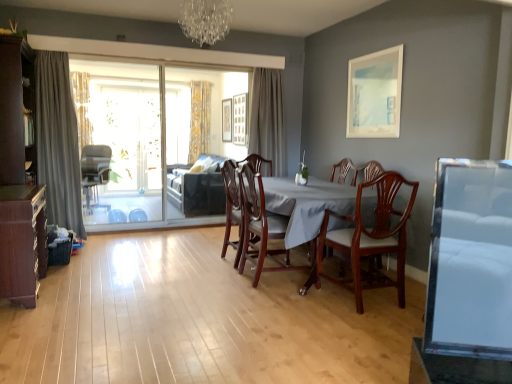
Question: Is mahogany wood table at center oriented away from mahogany wood dining chair at center, the 2th chair from the front?

Choices:
 (A) no
 (B) yes

Answer: (B)

Question: Is mahogany wood dining chair at center, the 3th chair in the left-to-right sequence, a part of mahogany wood table at center?

Choices:
 (A) yes
 (B) no

Answer: (A)

Question: Does mahogany wood table at center have a greater width compared to mahogany wood dining chair at center, marked as the second chair in a right-to-left arrangement?

Choices:
 (A) no
 (B) yes

Answer: (B)

Question: Is mahogany wood table at center bigger than mahogany wood dining chair at center, the 2th chair from the front?

Choices:
 (A) no
 (B) yes

Answer: (B)

Question: Is mahogany wood table at center to the left of mahogany wood dining chair at center, the 3th chair in the left-to-right sequence, from the viewer's perspective?

Choices:
 (A) no
 (B) yes

Answer: (A)

Question: In the image, is mahogany wood chair at center, the first chair when ordered from right to left, positioned in front of or behind gray fabric curtain at left, placed as the first curtain when sorted from front to back?

Choices:
 (A) front
 (B) behind

Answer: (A)

Question: Would you say mahogany wood chair at center, which is the fourth chair from left to right, is to the left or to the right of gray fabric curtain at left, which appears as the 4th curtain when viewed from the back, in the picture?

Choices:
 (A) right
 (B) left

Answer: (A)

Question: Based on their sizes in the image, would you say mahogany wood chair at center, the first chair when ordered from right to left, is bigger or smaller than gray fabric curtain at left, positioned as the 2th curtain in left-to-right order?

Choices:
 (A) big
 (B) small

Answer: (B)

Question: Which is correct: mahogany wood chair at center, which is the 4th chair from back to front, is inside gray fabric curtain at left, positioned as the 2th curtain in left-to-right order, or outside of it?

Choices:
 (A) inside
 (B) outside

Answer: (B)

Question: From the image's perspective, is gray fabric curtain at center, which is counted as the 3th curtain, starting from the back, positioned above or below mahogany wood dining chair at center, the 3th chair in the left-to-right sequence?

Choices:
 (A) above
 (B) below

Answer: (A)

Question: Considering the positions of gray fabric curtain at center, the 2th curtain when ordered from front to back, and mahogany wood dining chair at center, marked as the second chair in a right-to-left arrangement, in the image, is gray fabric curtain at center, the 2th curtain when ordered from front to back, taller or shorter than mahogany wood dining chair at center, marked as the second chair in a right-to-left arrangement,?

Choices:
 (A) tall
 (B) short

Answer: (A)

Question: Is gray fabric curtain at center, the 2th curtain when ordered from front to back, in front of or behind mahogany wood dining chair at center, marked as the second chair in a right-to-left arrangement, in the image?

Choices:
 (A) behind
 (B) front

Answer: (A)

Question: Is gray fabric curtain at center, the 2th curtain when ordered from front to back, bigger or smaller than mahogany wood dining chair at center, the 2th chair from the front?

Choices:
 (A) big
 (B) small

Answer: (B)

Question: Is transparent glass screen door at left bigger or smaller than white matte picture frame at upper right, which is the first picture frame in front-to-back order?

Choices:
 (A) big
 (B) small

Answer: (A)

Question: Is transparent glass screen door at left to the left or to the right of white matte picture frame at upper right, the third picture frame when ordered from back to front, in the image?

Choices:
 (A) left
 (B) right

Answer: (A)